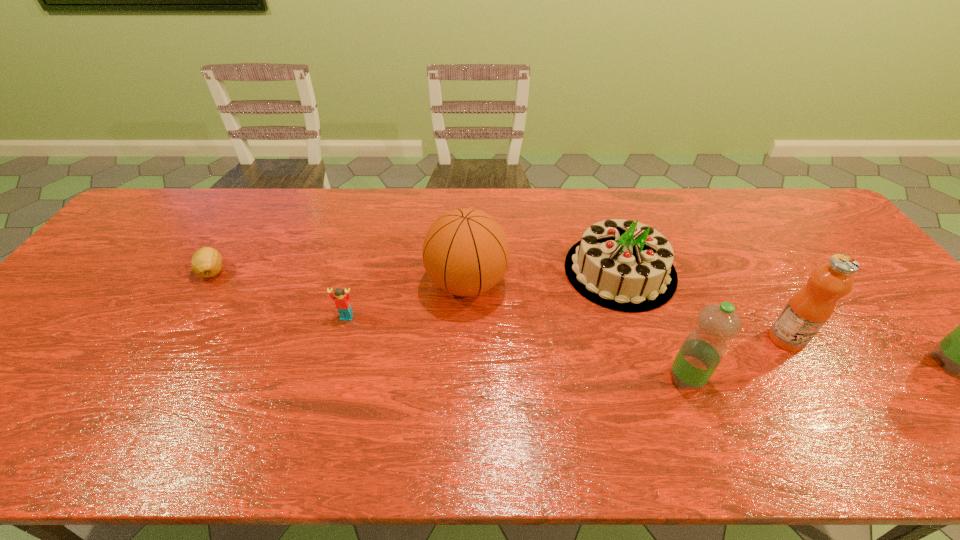
This screenshot has height=540, width=960. What are the coordinates of `blank region between the second shortest object and the lemon` in the screenshot? It's located at (279, 294).

Locate an element on the screen. Image resolution: width=960 pixels, height=540 pixels. unoccupied area between the basketball and the sixth object from right to left is located at coordinates (407, 300).

Where is `empty space between the sixth object from left to right and the shortest object`? empty space between the sixth object from left to right and the shortest object is located at coordinates (499, 305).

I want to click on vacant point located between the sixth object from right to left and the shortest object, so click(279, 294).

Locate an element on the screen. The image size is (960, 540). free space between the left water bottle and the birthday cake is located at coordinates (653, 325).

Where is `vacant point located between the shortest object and the sixth object from right to left`? vacant point located between the shortest object and the sixth object from right to left is located at coordinates (279, 294).

The width and height of the screenshot is (960, 540). In order to click on free area in between the shortest object and the birthday cake in this screenshot , I will do `click(416, 271)`.

Locate an element on the screen. empty space that is in between the birthday cake and the shortest object is located at coordinates (416, 271).

I want to click on object that is the fifth closest to the second object from right to left, so click(x=342, y=302).

Identify which object is the fourth nearest to the fifth object from right to left. Please provide its 2D coordinates. Your answer should be formatted as a tuple, i.e. [(x, y)], where the tuple contains the x and y coordinates of a point satisfying the conditions above.

[(206, 262)]